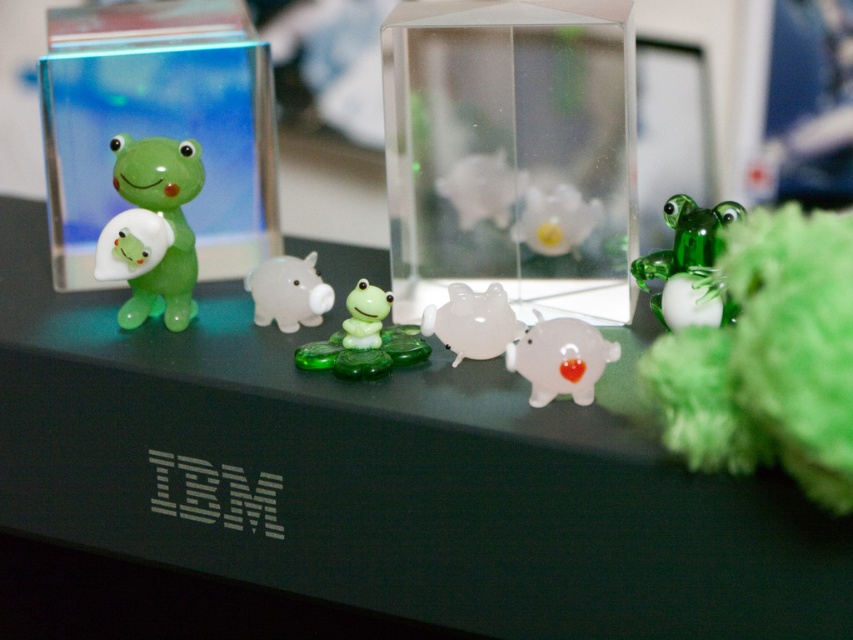
Does green translucent frog at left have a greater height compared to transparent glass piggy bank at center?

Yes, green translucent frog at left is taller than transparent glass piggy bank at center.

Is point (117, 216) less distant than point (570, 317)?

No, (117, 216) is further to viewer.

You are a GUI agent. You are given a task and a screenshot of the screen. Output one action in this format:
    pyautogui.click(x=<x>, y=<y>)
    Task: Click on the green translucent frog at left
    
    Given the screenshot: What is the action you would take?
    pyautogui.click(x=152, y=228)

This screenshot has height=640, width=853. What do you see at coordinates (161, 134) in the screenshot?
I see `green glass frog at left` at bounding box center [161, 134].

Which is more to the left, green glass frog at left or transparent glass piggy bank at center?

Positioned to the left is green glass frog at left.

Which is behind, point (94, 170) or point (521, 340)?

The point (94, 170) is behind.

This screenshot has height=640, width=853. I want to click on green glass frog at left, so [x=161, y=134].

Is point (161, 52) behind point (300, 260)?

Yes, point (161, 52) is farther from viewer.

Does green glass frog at left have a smaller size compared to white glossy piggy bank at center?

Incorrect, green glass frog at left is not smaller in size than white glossy piggy bank at center.

The height and width of the screenshot is (640, 853). Identify the location of green glass frog at left. (161, 134).